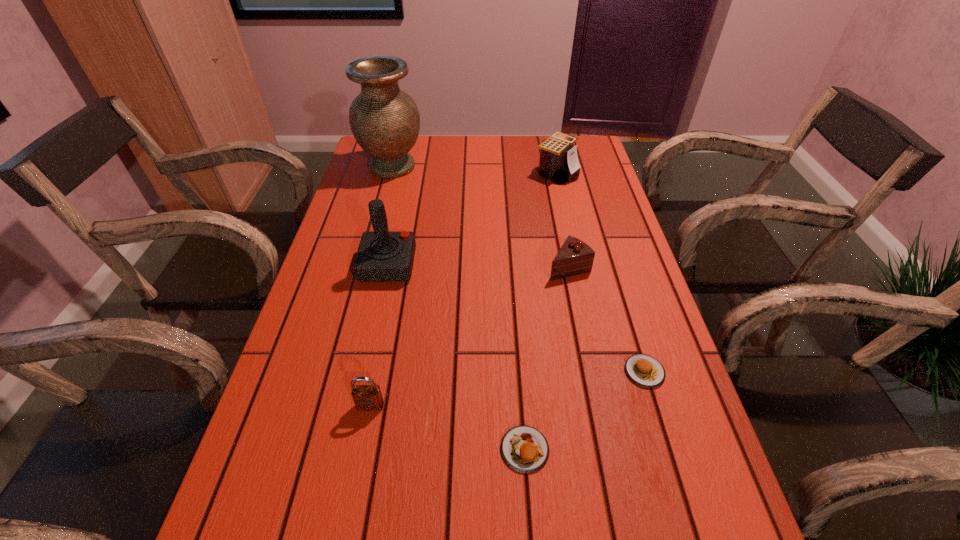
Choose which object is the third nearest neighbor to the chocolate cake. Please provide its 2D coordinates. Your answer should be formatted as a tuple, i.e. [(x, y)], where the tuple contains the x and y coordinates of a point satisfying the conditions above.

[(383, 256)]

Identify which object is the third closest to the farther food. Please provide its 2D coordinates. Your answer should be formatted as a tuple, i.e. [(x, y)], where the tuple contains the x and y coordinates of a point satisfying the conditions above.

[(366, 397)]

The height and width of the screenshot is (540, 960). In order to click on vacant space that satisfies the following two spatial constraints: 1. on the back side of the nearer food; 2. on the base of the sixth shortest object in this screenshot , I will do `click(512, 265)`.

Find the location of `free location that satisfies the following two spatial constraints: 1. on the front-facing side of the sixth farthest object; 2. on the left side of the nearer food`. free location that satisfies the following two spatial constraints: 1. on the front-facing side of the sixth farthest object; 2. on the left side of the nearer food is located at coordinates (362, 449).

Locate an element on the screen. free space that satisfies the following two spatial constraints: 1. on the front side of the tallest object; 2. on the right side of the chocolate cake is located at coordinates (366, 267).

This screenshot has height=540, width=960. In order to click on vacant position in the image that satisfies the following two spatial constraints: 1. on the back side of the left food; 2. on the right side of the third nearest object in this screenshot , I will do `click(519, 372)`.